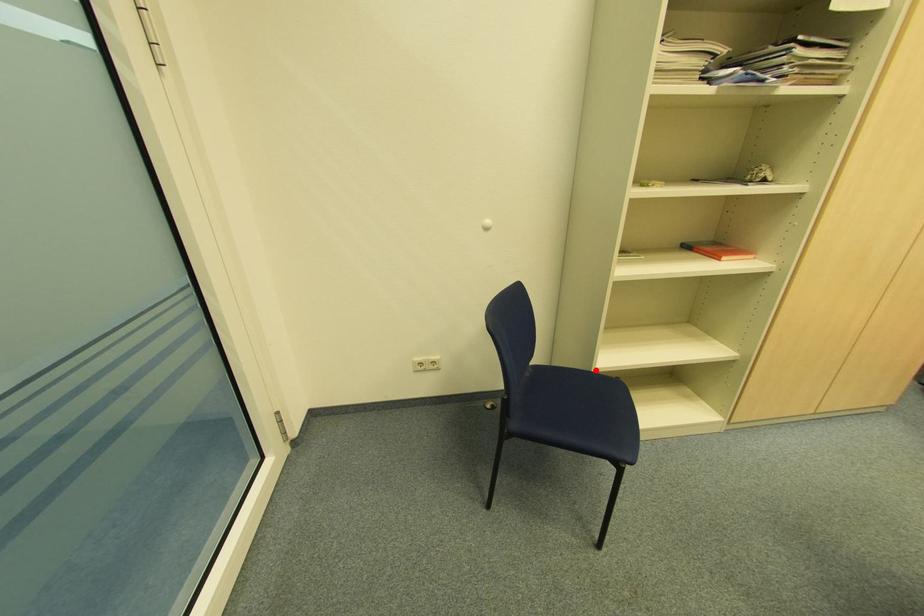
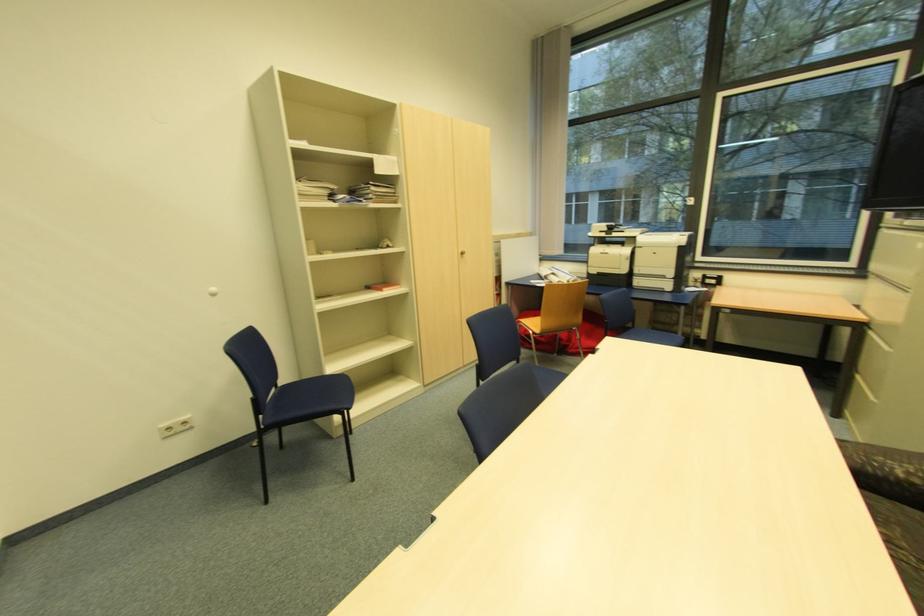
In the second image, find the point that corresponds to the highlighted location in the first image.

(325, 375)